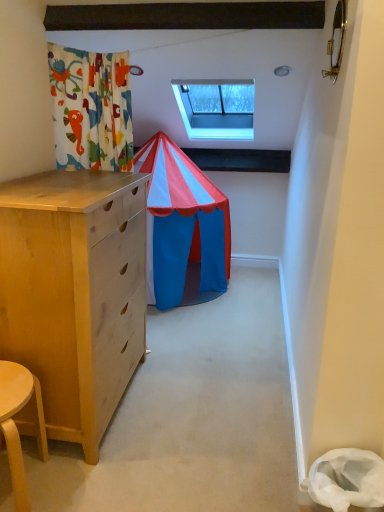
Question: Is transparent glass window at upper center turned away from light wood stool at lower left?

Choices:
 (A) yes
 (B) no

Answer: (B)

Question: Does transparent glass window at upper center appear on the left side of light wood stool at lower left?

Choices:
 (A) no
 (B) yes

Answer: (A)

Question: Is transparent glass window at upper center next to light wood stool at lower left and touching it?

Choices:
 (A) yes
 (B) no

Answer: (B)

Question: Does transparent glass window at upper center have a greater height compared to light wood stool at lower left?

Choices:
 (A) no
 (B) yes

Answer: (B)

Question: Is transparent glass window at upper center bigger than light wood stool at lower left?

Choices:
 (A) no
 (B) yes

Answer: (B)

Question: Can you confirm if transparent glass window at upper center is smaller than light wood stool at lower left?

Choices:
 (A) no
 (B) yes

Answer: (A)

Question: Is light wood stool at lower left positioned behind transparent glass window at upper center?

Choices:
 (A) no
 (B) yes

Answer: (A)

Question: Is light wood stool at lower left touching transparent glass window at upper center?

Choices:
 (A) yes
 (B) no

Answer: (B)

Question: Can you confirm if light wood stool at lower left is thinner than transparent glass window at upper center?

Choices:
 (A) yes
 (B) no

Answer: (A)

Question: Considering the relative sizes of light wood stool at lower left and transparent glass window at upper center in the image provided, is light wood stool at lower left taller than transparent glass window at upper center?

Choices:
 (A) yes
 (B) no

Answer: (B)

Question: Considering the relative positions of light wood stool at lower left and transparent glass window at upper center in the image provided, is light wood stool at lower left to the left of transparent glass window at upper center from the viewer's perspective?

Choices:
 (A) no
 (B) yes

Answer: (B)

Question: From the image's perspective, is light wood stool at lower left beneath transparent glass window at upper center?

Choices:
 (A) no
 (B) yes

Answer: (B)

Question: Considering the positions of transparent glass window at upper center and light wood stool at lower left in the image, is transparent glass window at upper center taller or shorter than light wood stool at lower left?

Choices:
 (A) tall
 (B) short

Answer: (A)